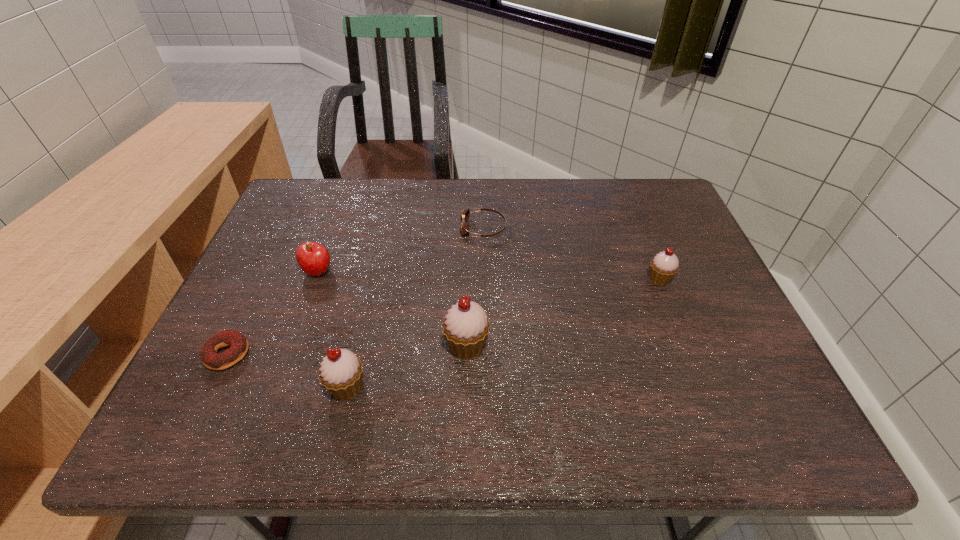
At what (x,y) coordinates should I click in order to perform the action: click on the fifth closest object to the farthest object. Please return your answer as a coordinate pair (x, y). Looking at the image, I should click on (238, 343).

Identify which cupcake is the second closest to the second cupcake from right to left. Please provide its 2D coordinates. Your answer should be formatted as a tuple, i.e. [(x, y)], where the tuple contains the x and y coordinates of a point satisfying the conditions above.

[(664, 266)]

The height and width of the screenshot is (540, 960). I want to click on cupcake that is the second closest to the doughnut, so click(x=465, y=328).

Find the location of a particular element. This screenshot has height=540, width=960. free location that satisfies the following two spatial constraints: 1. through the lenses of the farthest object; 2. on the right side of the farthest cupcake is located at coordinates (484, 279).